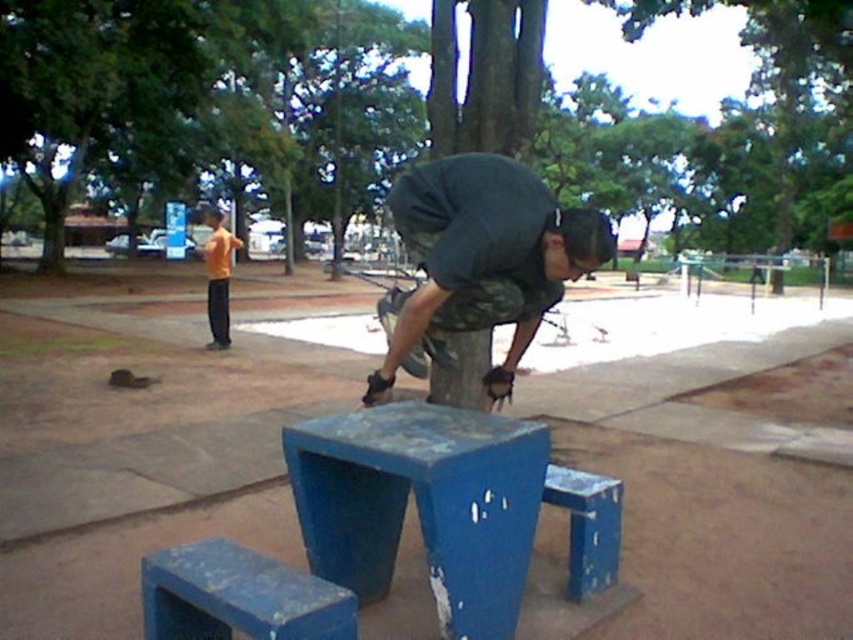
Question: Which object is positioned farthest from the blue painted wood step stool at lower center?

Choices:
 (A) orange shirt at left
 (B) camouflage pants at center
 (C) blue painted wood step stool at lower right

Answer: (A)

Question: Can you confirm if blue painted wood step stool at lower center is wider than orange shirt at left?

Choices:
 (A) no
 (B) yes

Answer: (A)

Question: Which is farther from the camouflage pants at center?

Choices:
 (A) blue painted wood step stool at lower right
 (B) blue painted wood step stool at lower center
 (C) orange shirt at left

Answer: (C)

Question: Can you confirm if camouflage pants at center is positioned to the right of blue painted wood step stool at lower center?

Choices:
 (A) yes
 (B) no

Answer: (A)

Question: Among these objects, which one is nearest to the camera?

Choices:
 (A) camouflage pants at center
 (B) blue painted wood step stool at lower right
 (C) orange shirt at left

Answer: (A)

Question: Does camouflage pants at center appear over blue painted wood step stool at lower right?

Choices:
 (A) no
 (B) yes

Answer: (B)